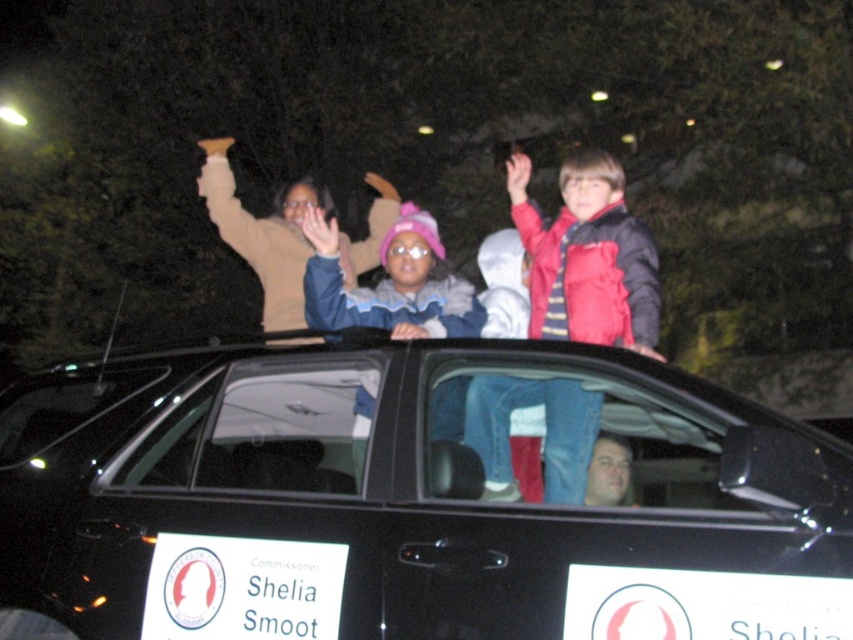
Question: Can you confirm if red fleece jacket at upper right is positioned below blue fleece jacket at center?

Choices:
 (A) yes
 (B) no

Answer: (B)

Question: Estimate the real-world distances between objects in this image. Which object is farther from the black matte car at center?

Choices:
 (A) blue fleece jacket at center
 (B) red fleece jacket at upper right

Answer: (B)

Question: Which of these objects is positioned farthest from the black matte car at center?

Choices:
 (A) blue fleece jacket at center
 (B) red fleece jacket at upper right

Answer: (B)

Question: Which point is closer to the camera?

Choices:
 (A) (550, 388)
 (B) (310, 220)
 (C) (112, 604)

Answer: (C)

Question: Is black matte car at center thinner than red fleece jacket at upper right?

Choices:
 (A) yes
 (B) no

Answer: (B)

Question: Is black matte car at center above red fleece jacket at upper right?

Choices:
 (A) no
 (B) yes

Answer: (A)